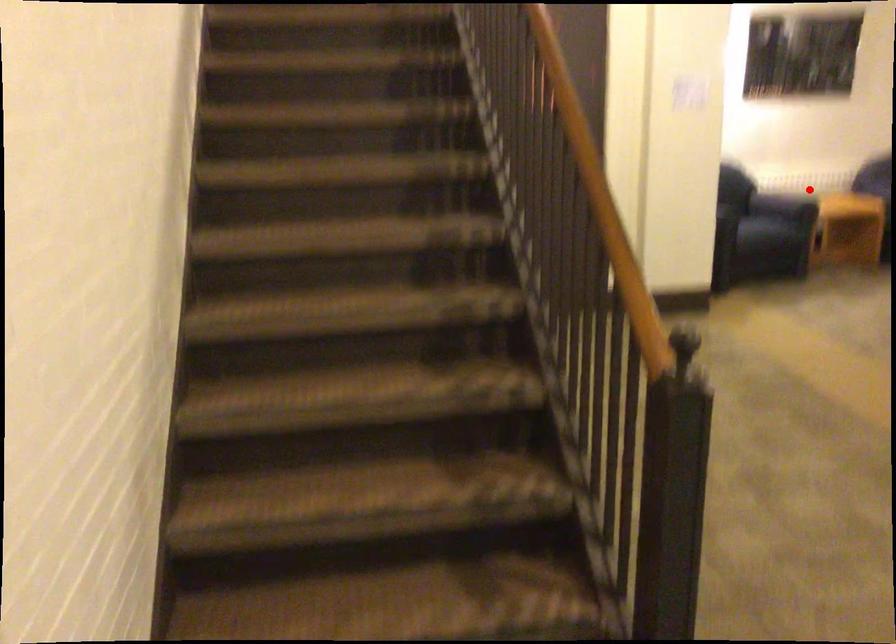
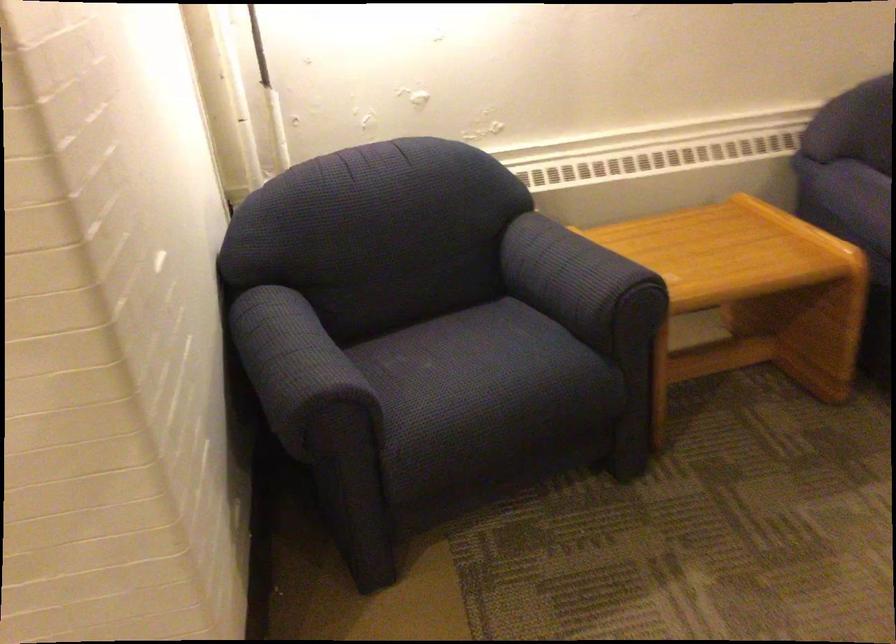
Find the pixel in the second image that matches the highlighted location in the first image.

(579, 281)